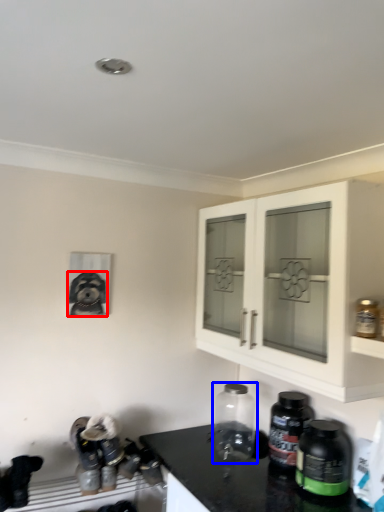
Question: Which object is closer to the camera taking this photo, dog (highlighted by a red box) or bottle (highlighted by a blue box)?

Choices:
 (A) dog
 (B) bottle

Answer: (B)